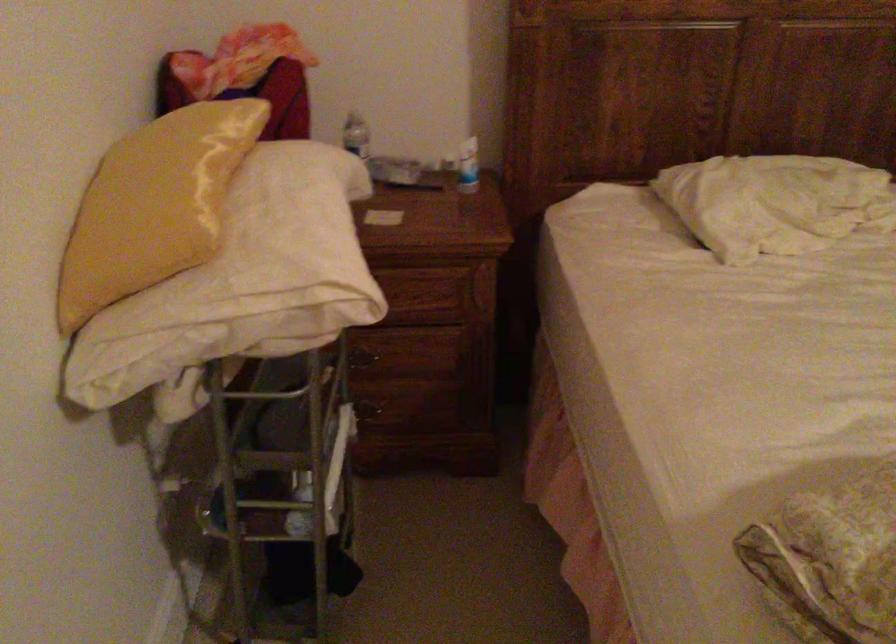
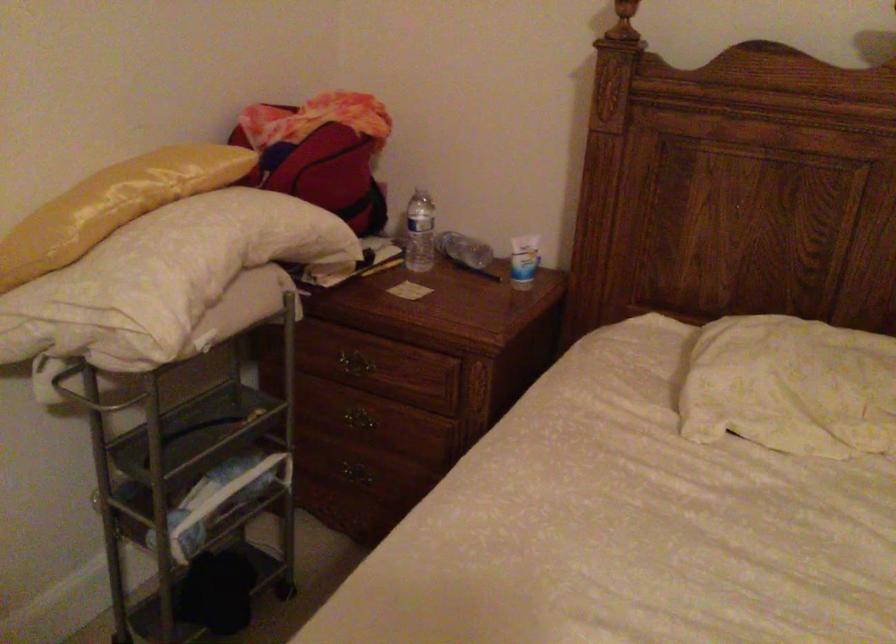
Question: I am providing you with two images of the same scene from different viewpoints. Please identify which objects are invisible in image2.

Choices:
 (A) plastic water bottle
 (B) white patterned pillow
 (C) yellow pillow
 (D) none of these

Answer: (D)